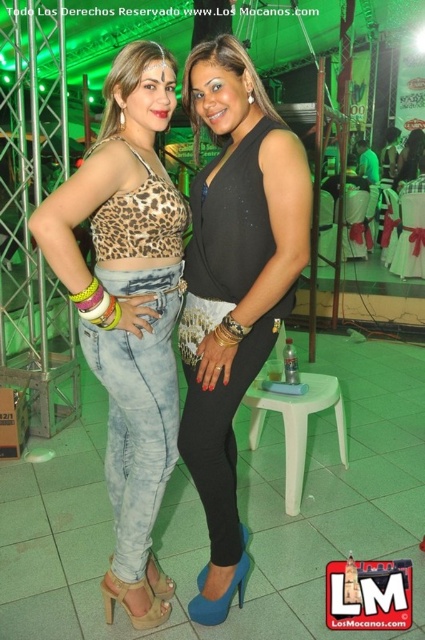
You are a photographer at the event and need to decide whether to place a narrow accessory between the leopard print fabric top at center and the light green plastic stool at center. Based on their widths, will the accessory fit if it is 10 cm wide?

The leopard print fabric top at center is thinner than the light green plastic stool at center. Since the accessory is 10 cm wide, it can fit between them as there is enough space between the two objects.

You are at an event with two points marked in the image. The first point is at coordinate point (127, 244) and the second is at point (291, 428). Which point is closer to you?

Point (127, 244) is closer to the viewer than point (291, 428).